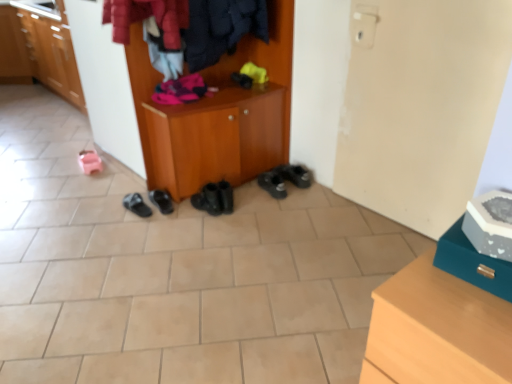
Image resolution: width=512 pixels, height=384 pixels. Identify the location of free space that is to the left of black rubber shoes at center, the 4th footwear positioned from the right. (124, 206).